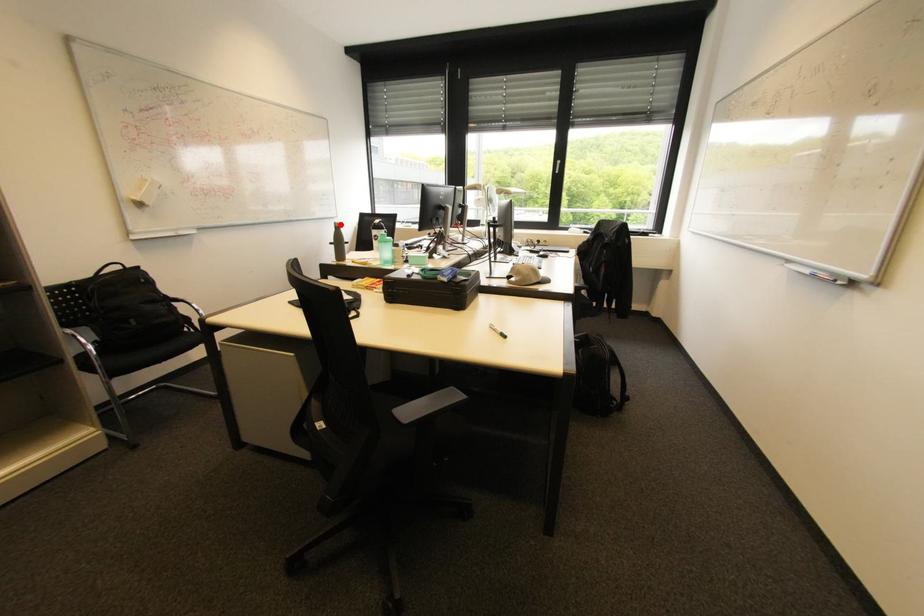
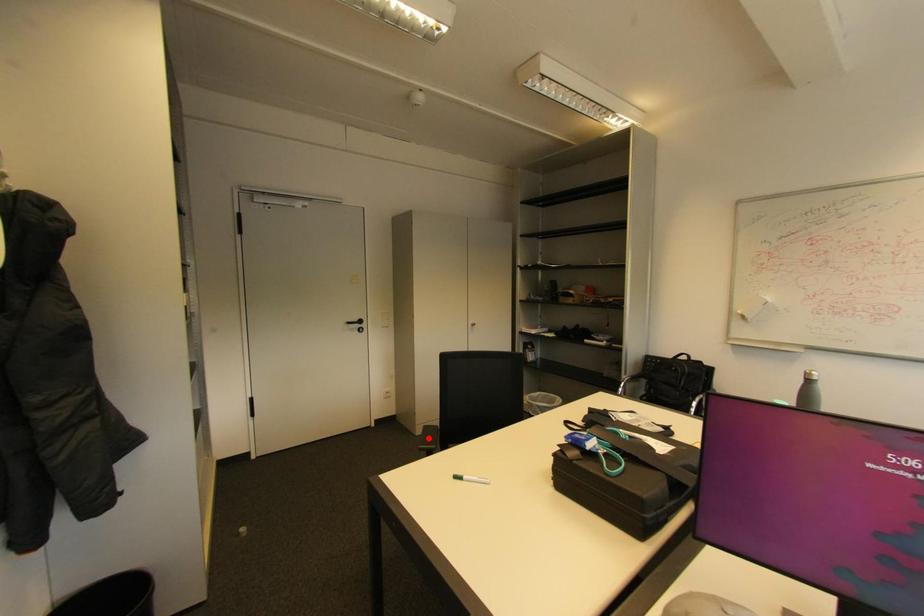
I am providing you with two images of the same scene from different viewpoints. A red point is marked on the first image and another point is marked on the second image. Do the highlighted points in image1 and image2 indicate the same real-world spot?

No